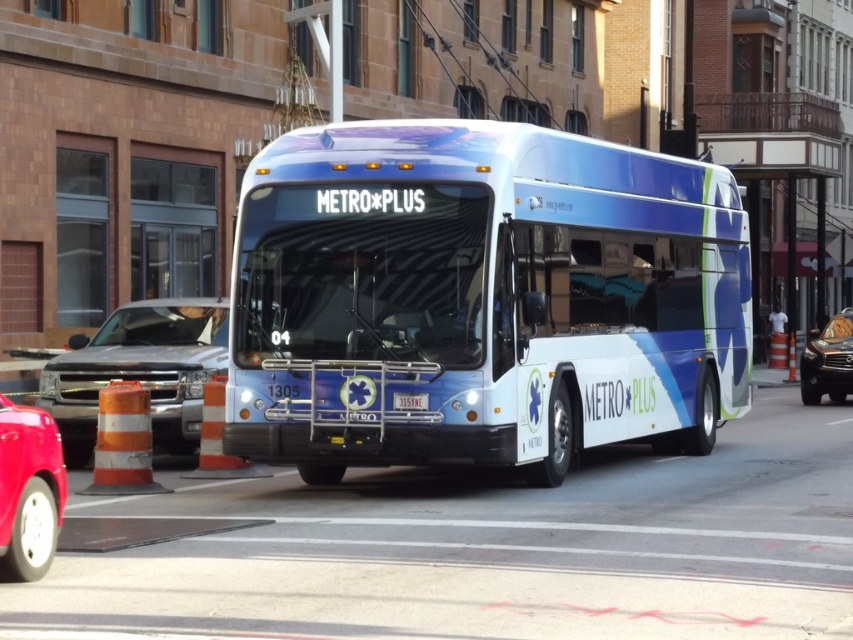
Is glass window at right thinner than shiny silver suv at right?

In fact, glass window at right might be wider than shiny silver suv at right.

Who is more distant from viewer, (791, 276) or (805, 401)?

The point (791, 276) is more distant.

Locate an element on the screen. glass window at right is located at coordinates (785, 234).

This screenshot has width=853, height=640. Describe the element at coordinates (138, 371) in the screenshot. I see `metallic silver truck at left` at that location.

Between point (160, 401) and point (827, 372), which one is positioned in front?

Point (160, 401)

Between point (144, 385) and point (840, 353), which one is positioned behind?

Point (840, 353)

At what (x,y) coordinates should I click in order to perform the action: click on metallic silver truck at left. Please return your answer as a coordinate pair (x, y). This screenshot has width=853, height=640. Looking at the image, I should click on (138, 371).

Is the position of shiny red car at lower left less distant than that of blue metallic license plate at center?

That is True.

Can you confirm if shiny red car at lower left is positioned to the right of blue metallic license plate at center?

No, shiny red car at lower left is not to the right of blue metallic license plate at center.

Who is more forward, (10, 506) or (410, 397)?

Point (10, 506) is in front.

The width and height of the screenshot is (853, 640). Identify the location of shiny red car at lower left. (28, 490).